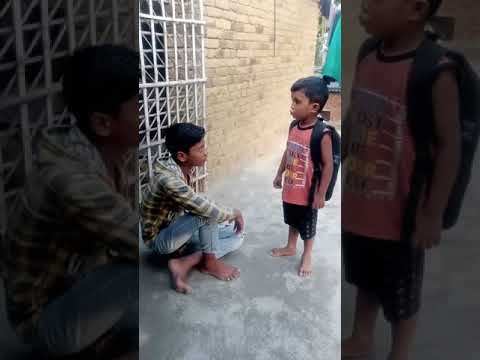
This screenshot has height=360, width=480. In order to click on floor in this screenshot , I will do `click(260, 344)`.